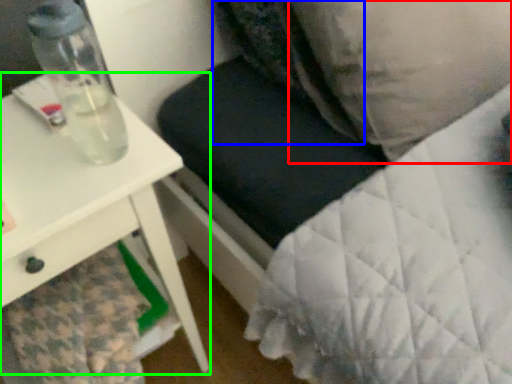
Question: Which object is positioned farthest from pillow (highlighted by a red box)? Select from pillow (highlighted by a blue box) and table (highlighted by a green box).

Choices:
 (A) pillow
 (B) table

Answer: (B)